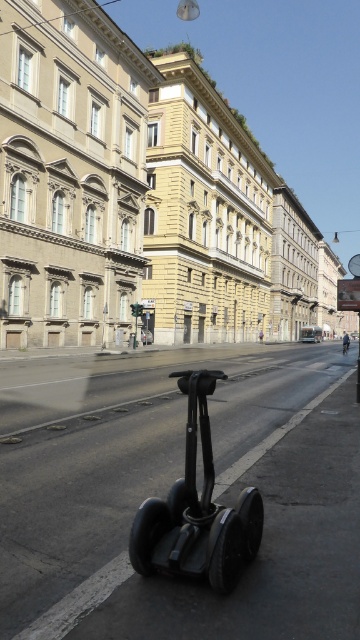
You are a delivery person who needs to park your black rubber scooter at center and green metallic bus at center on the same street. Given the space available, which vehicle can be parked without needing to adjust its position?

The black rubber scooter at center can be parked without needing to adjust its position because it is smaller than the green metallic bus at center, which may require more space.

Consider the image. You are a delivery person who needs to park your black rubber scooter at center exactly at the point marked as point (196, 509). Is the current position of the black rubber scooter at center correct?

The black rubber scooter at center is already located at point (196, 509), so the current position is correct.

You are standing on the street and see two points marked on the buildings in the background. The first point is at coordinates point [249,502] and the second is at point [308,340]. Which point is closer to you?

Point [249,502] is closer to the viewer than point [308,340].